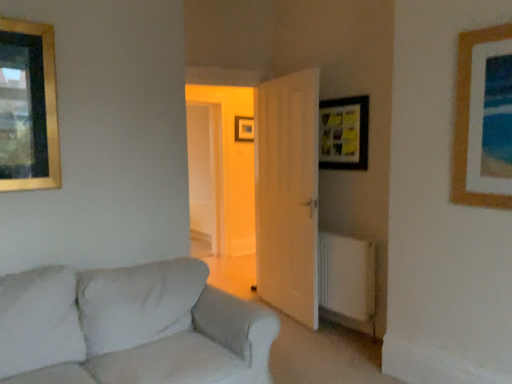
Question: Can you confirm if gold-framed picture at upper left, positioned as the first picture frame in left-to-right order, is shorter than white plastic radiator at lower right?

Choices:
 (A) yes
 (B) no

Answer: (B)

Question: From a real-world perspective, is gold-framed picture at upper left, which ranks as the 2th picture frame in front-to-back order, beneath white plastic radiator at lower right?

Choices:
 (A) no
 (B) yes

Answer: (A)

Question: Is white plastic radiator at lower right a part of gold-framed picture at upper left, the 4th picture frame in the right-to-left sequence?

Choices:
 (A) no
 (B) yes

Answer: (A)

Question: Can you confirm if gold-framed picture at upper left, which ranks as the 2th picture frame in front-to-back order, is positioned to the right of white plastic radiator at lower right?

Choices:
 (A) yes
 (B) no

Answer: (B)

Question: Can you confirm if gold-framed picture at upper left, positioned as the first picture frame in left-to-right order, is bigger than white plastic radiator at lower right?

Choices:
 (A) no
 (B) yes

Answer: (A)

Question: Is white fabric couch at lower left in front of or behind white plastic radiator at lower right in the image?

Choices:
 (A) behind
 (B) front

Answer: (B)

Question: From the image's perspective, is white fabric couch at lower left positioned above or below white plastic radiator at lower right?

Choices:
 (A) above
 (B) below

Answer: (B)

Question: Do you think white fabric couch at lower left is within white plastic radiator at lower right, or outside of it?

Choices:
 (A) inside
 (B) outside

Answer: (B)

Question: Looking at their shapes, would you say white fabric couch at lower left is wider or thinner than white plastic radiator at lower right?

Choices:
 (A) thin
 (B) wide

Answer: (B)

Question: Considering the positions of wooden picture frame at upper right, marked as the first picture frame in a front-to-back arrangement, and white plastic radiator at lower right in the image, is wooden picture frame at upper right, marked as the first picture frame in a front-to-back arrangement, wider or thinner than white plastic radiator at lower right?

Choices:
 (A) wide
 (B) thin

Answer: (B)

Question: Relative to white plastic radiator at lower right, is wooden picture frame at upper right, the 4th picture frame positioned from the back, in front or behind?

Choices:
 (A) behind
 (B) front

Answer: (B)

Question: In terms of height, does wooden picture frame at upper right, acting as the 4th picture frame starting from the left, look taller or shorter compared to white plastic radiator at lower right?

Choices:
 (A) tall
 (B) short

Answer: (A)

Question: Is wooden picture frame at upper right, which appears as the first picture frame when viewed from the right, situated inside white plastic radiator at lower right or outside?

Choices:
 (A) inside
 (B) outside

Answer: (B)

Question: Is wooden picture frame at center, which ranks as the third picture frame in right-to-left order, in front of or behind gold-framed picture at upper left, the 4th picture frame in the right-to-left sequence, in the image?

Choices:
 (A) behind
 (B) front

Answer: (A)

Question: From a real-world perspective, is wooden picture frame at center, the 1th picture frame when ordered from back to front, physically located above or below gold-framed picture at upper left, positioned as the first picture frame in left-to-right order?

Choices:
 (A) below
 (B) above

Answer: (B)